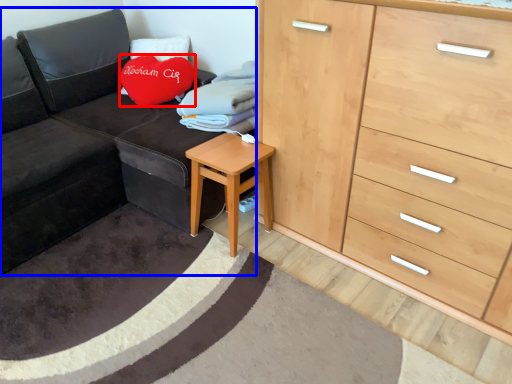
Question: Which point is closer to the camera, throw pillow (highlighted by a red box) or studio couch (highlighted by a blue box)?

Choices:
 (A) throw pillow
 (B) studio couch

Answer: (B)